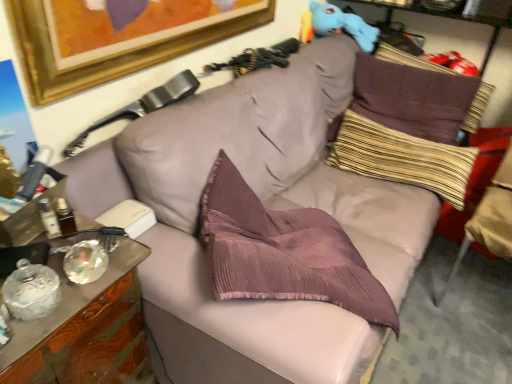
Image resolution: width=512 pixels, height=384 pixels. What do you see at coordinates (407, 59) in the screenshot?
I see `purple corduroy pillow at upper right, placed as the first pillow when sorted from top to bottom` at bounding box center [407, 59].

In order to face blue plush toy at upper right, should I rotate leftwards or rightwards?

Turn right approximately 11.833 degrees to face it.

Measure the distance between striped fabric pillow at upper right, which is counted as the 1th pillow, starting from the bottom, and camera.

striped fabric pillow at upper right, which is counted as the 1th pillow, starting from the bottom, and camera are 1.88 meters apart from each other.

You are a GUI agent. You are given a task and a screenshot of the screen. Output one action in this format:
    pyautogui.click(x=<x>, y=<y>)
    Task: Click on the beige fabric swivel chair at right, the 1th swivel chair positioned from the right
    This screenshot has width=512, height=384.
    Given the screenshot: What is the action you would take?
    coord(489,221)

Consider the image. What's the angular difference between blue plush toy at upper right and wooden cabinet at left's facing directions?

There is a 1.58-degree angle between the facing directions of blue plush toy at upper right and wooden cabinet at left.

From a real-world perspective, who is located higher, blue plush toy at upper right or wooden cabinet at left?

blue plush toy at upper right, from a real-world perspective.

Could you tell me if blue plush toy at upper right is turned towards wooden cabinet at left?

No, blue plush toy at upper right is not turned towards wooden cabinet at left.

From the image's perspective, between blue plush toy at upper right and striped fabric pillow at upper right, which is counted as the 1th pillow, starting from the bottom, which one is located above?

blue plush toy at upper right is shown above in the image.

Is there a large distance between blue plush toy at upper right and striped fabric pillow at upper right, the second pillow viewed from the top?

blue plush toy at upper right is near striped fabric pillow at upper right, the second pillow viewed from the top, not far away.

Is blue plush toy at upper right positioned with its back to striped fabric pillow at upper right, which is counted as the 1th pillow, starting from the bottom?

blue plush toy at upper right is not turned away from striped fabric pillow at upper right, which is counted as the 1th pillow, starting from the bottom.

Who is shorter, blue plush toy at upper right or striped fabric pillow at upper right, which is counted as the 1th pillow, starting from the bottom?

blue plush toy at upper right is shorter.

Can you confirm if blue plush toy at upper right is smaller than beige fabric swivel chair at right, placed as the second swivel chair when sorted from left to right?

Indeed, blue plush toy at upper right has a smaller size compared to beige fabric swivel chair at right, placed as the second swivel chair when sorted from left to right.

Are blue plush toy at upper right and beige fabric swivel chair at right, the 1th swivel chair positioned from the right, far apart?

Indeed, blue plush toy at upper right is not near beige fabric swivel chair at right, the 1th swivel chair positioned from the right.

Would you say blue plush toy at upper right contains beige fabric swivel chair at right, placed as the second swivel chair when sorted from left to right?

No, beige fabric swivel chair at right, placed as the second swivel chair when sorted from left to right, is located outside of blue plush toy at upper right.

Does blue plush toy at upper right have a greater width compared to beige fabric swivel chair at right, placed as the second swivel chair when sorted from left to right?

No, blue plush toy at upper right is not wider than beige fabric swivel chair at right, placed as the second swivel chair when sorted from left to right.

Is striped fabric pillow at upper right, which is counted as the 1th pillow, starting from the bottom, oriented towards wooden cabinet at left?

Yes, striped fabric pillow at upper right, which is counted as the 1th pillow, starting from the bottom, is facing wooden cabinet at left.

Could you measure the distance between striped fabric pillow at upper right, the second pillow viewed from the top, and wooden cabinet at left?

A distance of 1.35 meters exists between striped fabric pillow at upper right, the second pillow viewed from the top, and wooden cabinet at left.

Is striped fabric pillow at upper right, which is counted as the 1th pillow, starting from the bottom, positioned far away from wooden cabinet at left?

Yes.

In the image, is striped fabric pillow at upper right, which is counted as the 1th pillow, starting from the bottom, positioned in front of or behind wooden cabinet at left?

Clearly, striped fabric pillow at upper right, which is counted as the 1th pillow, starting from the bottom, is behind wooden cabinet at left.

Locate an element on the screen. cabinetry on the left of beige fabric swivel chair at right, the 1th swivel chair positioned from the right is located at coordinates (85, 330).

Who is taller, beige fabric swivel chair at right, the 1th swivel chair positioned from the right, or wooden cabinet at left?

beige fabric swivel chair at right, the 1th swivel chair positioned from the right, is taller.

How many degrees apart are the facing directions of beige fabric swivel chair at right, placed as the second swivel chair when sorted from left to right, and wooden cabinet at left?

The angle between the facing direction of beige fabric swivel chair at right, placed as the second swivel chair when sorted from left to right, and the facing direction of wooden cabinet at left is 92.4 degrees.

From the image's perspective, between beige fabric swivel chair at right, placed as the second swivel chair when sorted from left to right, and wooden cabinet at left, which one is located above?

beige fabric swivel chair at right, placed as the second swivel chair when sorted from left to right, appears higher in the image.

From the picture: Is blue plush toy at upper right far from purple corduroy pillow at upper right, which is the second pillow from bottom to top?

No, blue plush toy at upper right is not far away from purple corduroy pillow at upper right, which is the second pillow from bottom to top.

Which of these two, blue plush toy at upper right or purple corduroy pillow at upper right, placed as the first pillow when sorted from top to bottom, is thinner?

purple corduroy pillow at upper right, placed as the first pillow when sorted from top to bottom.

Is blue plush toy at upper right facing away from purple corduroy pillow at upper right, placed as the first pillow when sorted from top to bottom?

No, blue plush toy at upper right is not facing the opposite direction of purple corduroy pillow at upper right, placed as the first pillow when sorted from top to bottom.

Between blue plush toy at upper right and purple corduroy pillow at upper right, which is the second pillow from bottom to top, which one has larger size?

Bigger between the two is purple corduroy pillow at upper right, which is the second pillow from bottom to top.

Who is more distant, beige fabric swivel chair at right, the 1th swivel chair positioned from the right, or leather at upper left, positioned as the 2th swivel chair in right-to-left order?

beige fabric swivel chair at right, the 1th swivel chair positioned from the right, is more distant.

How different are the orientations of beige fabric swivel chair at right, placed as the second swivel chair when sorted from left to right, and leather at upper left, positioned as the 2th swivel chair in right-to-left order, in degrees?

There is a 86.7-degree angle between the facing directions of beige fabric swivel chair at right, placed as the second swivel chair when sorted from left to right, and leather at upper left, positioned as the 2th swivel chair in right-to-left order.

How distant is beige fabric swivel chair at right, the 1th swivel chair positioned from the right, from leather at upper left, acting as the first swivel chair starting from the left?

beige fabric swivel chair at right, the 1th swivel chair positioned from the right, is 1.29 meters away from leather at upper left, acting as the first swivel chair starting from the left.

Who is smaller, beige fabric swivel chair at right, the 1th swivel chair positioned from the right, or leather at upper left, positioned as the 2th swivel chair in right-to-left order?

Smaller between the two is leather at upper left, positioned as the 2th swivel chair in right-to-left order.

I want to click on cabinetry below the blue plush toy at upper right (from the image's perspective), so click(85, 330).

Starting from the blue plush toy at upper right, which pillow is the 2nd one in front? Please provide its 2D coordinates.

[(402, 158)]

When comparing their distances from wooden cabinet at left, does blue plush toy at upper right or purple corduroy pillow at upper right, which is the second pillow from bottom to top, seem closer?

blue plush toy at upper right is positioned closer to the anchor wooden cabinet at left.

Looking at the image, which one is located further to wooden cabinet at left, striped fabric pillow at upper right, the second pillow viewed from the top, or leather at upper left, positioned as the 2th swivel chair in right-to-left order?

The object further to wooden cabinet at left is striped fabric pillow at upper right, the second pillow viewed from the top.

From the image, which object appears to be farther from blue plush toy at upper right, beige fabric swivel chair at right, the 1th swivel chair positioned from the right, or wooden cabinet at left?

The object further to blue plush toy at upper right is wooden cabinet at left.

Considering their positions, is leather at upper left, positioned as the 2th swivel chair in right-to-left order, positioned further to wooden cabinet at left than purple corduroy pillow at upper right, which is the second pillow from bottom to top?

The object further to wooden cabinet at left is purple corduroy pillow at upper right, which is the second pillow from bottom to top.

Looking at the image, which one is located closer to leather at upper left, positioned as the 2th swivel chair in right-to-left order, purple corduroy pillow at upper right, which is the second pillow from bottom to top, or beige fabric swivel chair at right, the 1th swivel chair positioned from the right?

The object closer to leather at upper left, positioned as the 2th swivel chair in right-to-left order, is beige fabric swivel chair at right, the 1th swivel chair positioned from the right.

Which object lies further to the anchor point blue plush toy at upper right, wooden cabinet at left or purple corduroy pillow at upper right, placed as the first pillow when sorted from top to bottom?

Among the two, wooden cabinet at left is located further to blue plush toy at upper right.

Considering their positions, is striped fabric pillow at upper right, the second pillow viewed from the top, positioned further to beige fabric swivel chair at right, the 1th swivel chair positioned from the right, than leather at upper left, positioned as the 2th swivel chair in right-to-left order?

Based on the image, leather at upper left, positioned as the 2th swivel chair in right-to-left order, appears to be further to beige fabric swivel chair at right, the 1th swivel chair positioned from the right.

Looking at the image, which one is located further to striped fabric pillow at upper right, the second pillow viewed from the top, beige fabric swivel chair at right, placed as the second swivel chair when sorted from left to right, or wooden cabinet at left?

wooden cabinet at left is positioned further to the anchor striped fabric pillow at upper right, the second pillow viewed from the top.

Identify the location of swivel chair between wooden cabinet at left and beige fabric swivel chair at right, the 1th swivel chair positioned from the right, from left to right. This screenshot has height=384, width=512. (143, 105).

Locate an element on the screen. toy between leather at upper left, positioned as the 2th swivel chair in right-to-left order, and purple corduroy pillow at upper right, placed as the first pillow when sorted from top to bottom, in the horizontal direction is located at coordinates (342, 24).

You are a GUI agent. You are given a task and a screenshot of the screen. Output one action in this format:
    pyautogui.click(x=<x>, y=<y>)
    Task: Click on the toy located between leather at upper left, acting as the first swivel chair starting from the left, and beige fabric swivel chair at right, the 1th swivel chair positioned from the right, in the left-right direction
    
    Given the screenshot: What is the action you would take?
    pyautogui.click(x=342, y=24)

The width and height of the screenshot is (512, 384). I want to click on pillow between leather at upper left, acting as the first swivel chair starting from the left, and purple corduroy pillow at upper right, placed as the first pillow when sorted from top to bottom, so click(402, 158).